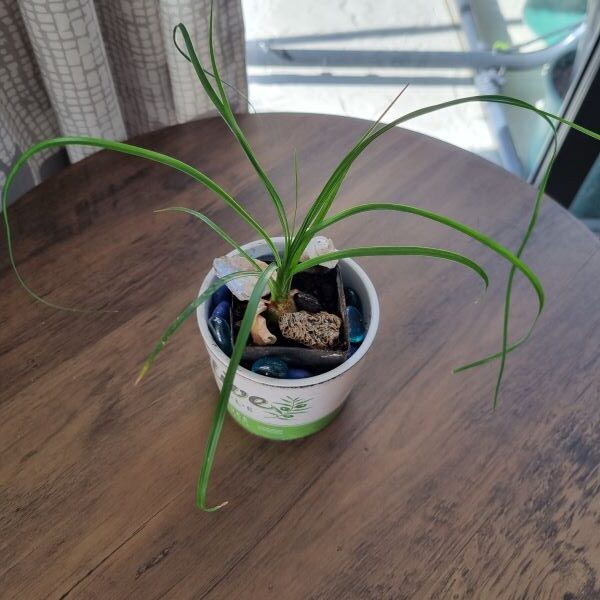
You are a GUI agent. You are given a task and a screenshot of the screen. Output one action in this format:
    pyautogui.click(x=<x>, y=<y>)
    Task: Click on the table top
    Image resolution: width=600 pixels, height=600 pixels.
    Given the screenshot: What is the action you would take?
    pyautogui.click(x=173, y=405)